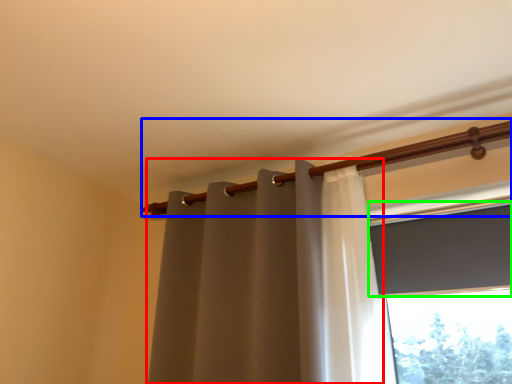
Question: Considering the real-world distances, which object is farthest from curtain (highlighted by a red box)? beam (highlighted by a blue box) or window screen (highlighted by a green box)?

Choices:
 (A) beam
 (B) window screen

Answer: (B)